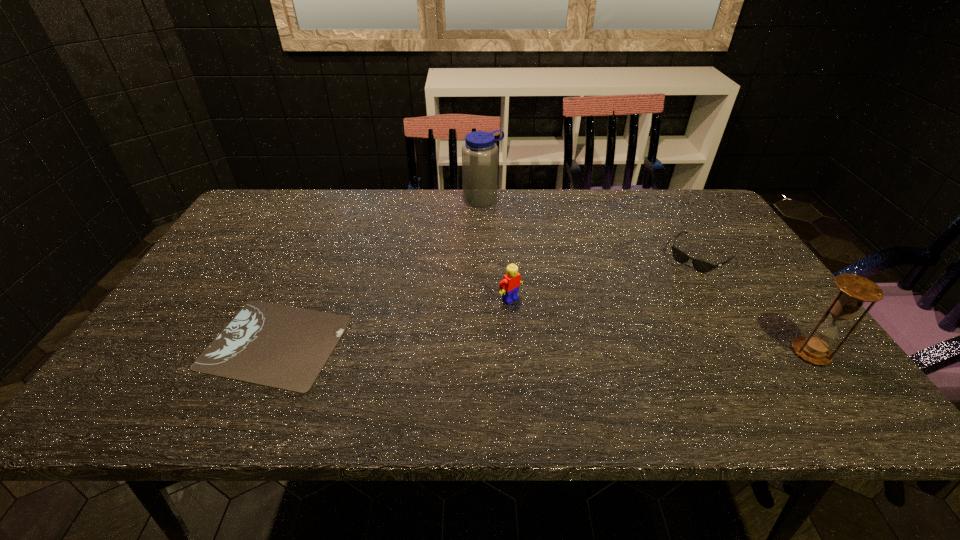
Where is `empty space that is in between the leftmost object and the hourglass`? empty space that is in between the leftmost object and the hourglass is located at coordinates (543, 347).

The width and height of the screenshot is (960, 540). Find the location of `empty space that is in between the Lego and the hourglass`. empty space that is in between the Lego and the hourglass is located at coordinates (660, 326).

Where is `empty location between the hourglass and the Lego`? This screenshot has width=960, height=540. empty location between the hourglass and the Lego is located at coordinates point(660,326).

Find the location of a particular element. The width and height of the screenshot is (960, 540). object that is the closest one to the Lego is located at coordinates (284, 347).

Identify which object is located as the nearest to the second shortest object. Please provide its 2D coordinates. Your answer should be formatted as a tuple, i.e. [(x, y)], where the tuple contains the x and y coordinates of a point satisfying the conditions above.

[(855, 290)]

In order to click on vacant space that satisfies the following two spatial constraints: 1. on the back side of the farthest object; 2. on the left side of the mousepad in this screenshot , I will do `click(341, 199)`.

At what (x,y) coordinates should I click in order to perform the action: click on vacant position in the image that satisfies the following two spatial constraints: 1. on the back side of the Lego; 2. on the left side of the leftmost object. Please return your answer as a coordinate pair (x, y). This screenshot has height=540, width=960. Looking at the image, I should click on (295, 299).

You are a GUI agent. You are given a task and a screenshot of the screen. Output one action in this format:
    pyautogui.click(x=<x>, y=<y>)
    Task: Click on the free space that satisfies the following two spatial constraints: 1. on the back side of the third tallest object; 2. on the right side of the second shortest object
    The height and width of the screenshot is (540, 960).
    Given the screenshot: What is the action you would take?
    pyautogui.click(x=507, y=255)

This screenshot has width=960, height=540. I want to click on vacant space that satisfies the following two spatial constraints: 1. on the back side of the water bottle; 2. on the left side of the shortest object, so click(341, 199).

Find the location of `free region that satisfies the following two spatial constraints: 1. on the back side of the fourth tallest object; 2. on the left side of the third tallest object`. free region that satisfies the following two spatial constraints: 1. on the back side of the fourth tallest object; 2. on the left side of the third tallest object is located at coordinates (507, 255).